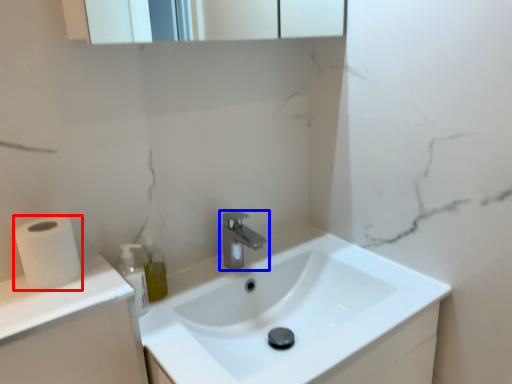
Question: Which object is closer to the camera taking this photo, toilet paper (highlighted by a red box) or tap (highlighted by a blue box)?

Choices:
 (A) toilet paper
 (B) tap

Answer: (A)